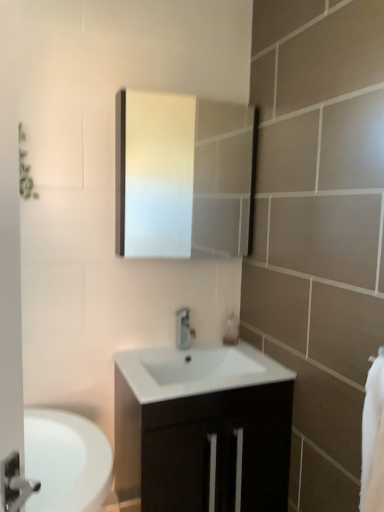
Question: From a real-world perspective, relative to white glossy medicine cabinet at upper center, is white glossy sink at center vertically above or below?

Choices:
 (A) above
 (B) below

Answer: (B)

Question: Which is correct: white glossy sink at center is inside white glossy medicine cabinet at upper center, or outside of it?

Choices:
 (A) outside
 (B) inside

Answer: (A)

Question: Considering the real-world distances, which object is closest to the white glossy medicine cabinet at upper center?

Choices:
 (A) silver metallic faucet at center
 (B) translucent plastic soap dispenser at center
 (C) white glossy sink at center
 (D) white glossy cabinet at center
 (E) white soft towel at right

Answer: (C)

Question: Estimate the real-world distances between objects in this image. Which object is closer to the white glossy sink at center?

Choices:
 (A) silver metallic faucet at center
 (B) white glossy medicine cabinet at upper center
 (C) white glossy cabinet at center
 (D) translucent plastic soap dispenser at center
 (E) white soft towel at right

Answer: (A)